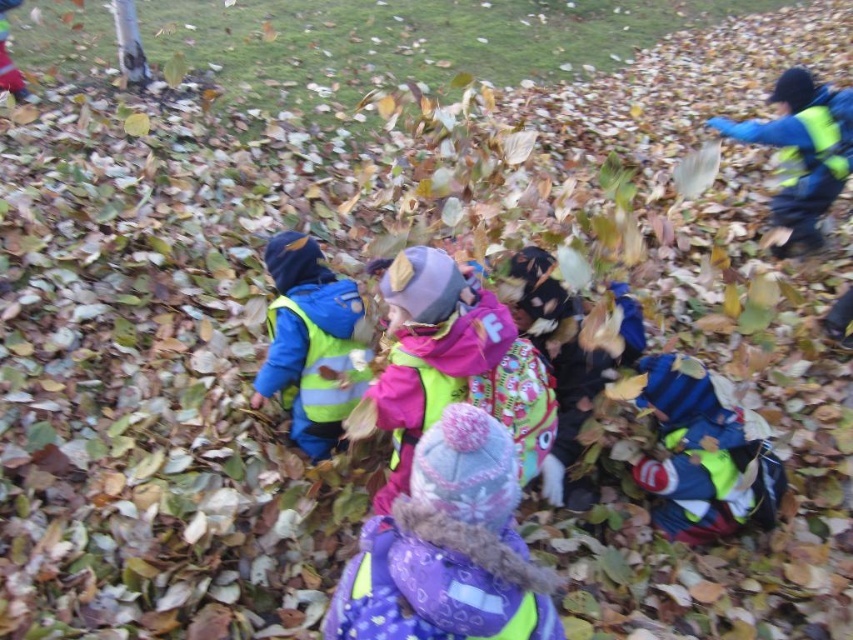
You are a photographer trying to capture a photo that includes both the vibrant pink fleece at center and the reflective yellow vest at center. Based on their positions, which object should you adjust your camera angle to focus on first to ensure both are in the frame?

The vibrant pink fleece at center is to the right of the reflective yellow vest at center. To ensure both are in the frame, you should first focus on the reflective yellow vest at center and then adjust your angle to include the vibrant pink fleece at center to its right.

You are a photographer trying to capture a clear shot of the vibrant pink fleece at center and the reflective yellow vest at center. Which object should you focus on first to ensure both are in focus?

The vibrant pink fleece at center is in front of the reflective yellow vest at center, so you should focus on the vibrant pink fleece at center first to ensure both are in focus.

You are a photographer trying to capture a photo of the vibrant pink fleece at center and the reflective yellow vest at center. Since you want both items to appear the same size in the photo, which object should you move closer to and which should you move farther away?

Since the vibrant pink fleece at center is larger than the reflective yellow vest at center, you should move the reflective yellow vest at center closer to the camera and move the vibrant pink fleece at center farther away to balance their sizes in the photo.